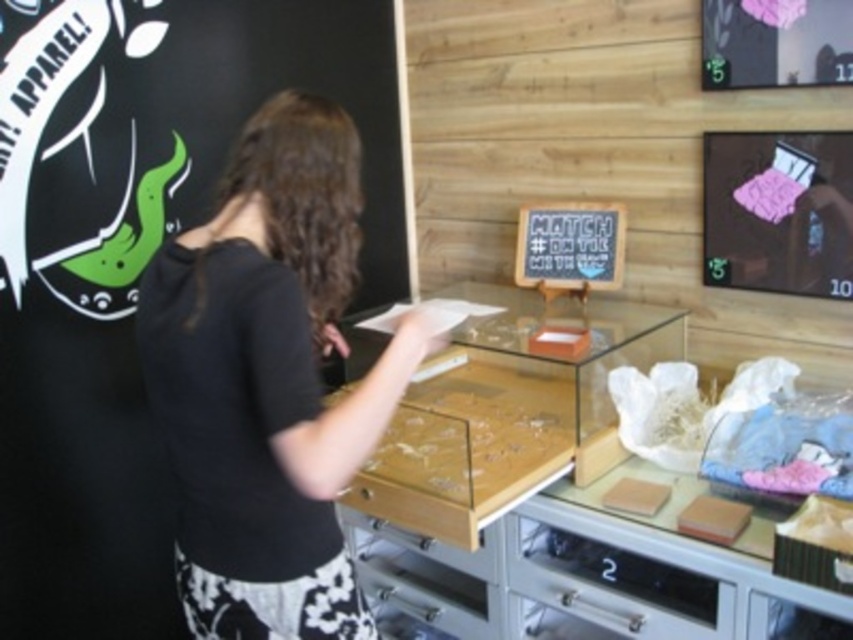
Where is the metallic silver drawer at lower center located in the image?

The metallic silver drawer at lower center is located at point (614,584) in the image.

You are a customer in a store and you want to see both the pink fabric bed at upper right and the metallic silver drawer at lower center. Which one should you look to your right to see?

The pink fabric bed at upper right is positioned on the right side of the metallic silver drawer at lower center, so you should look to your right to see the pink fabric bed at upper right.

You are a customer in the store and want to find the pink fabric bed at upper right. According to the scene description, where should you look relative to the counter?

The pink fabric bed at upper right is located at point (778,211), which corresponds to the upper right area of the scene. You should look towards the upper right direction from the counter to find it.